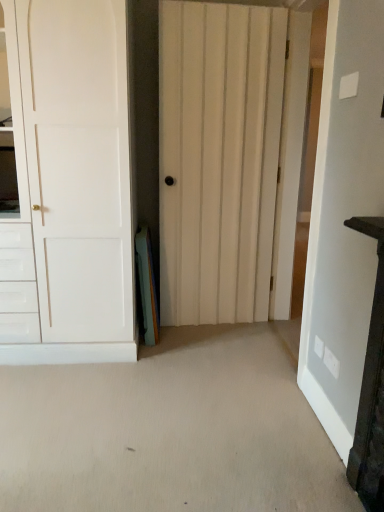
Question: Is white wooden door at center, the first door in the right-to-left sequence, at the left side of dark wood vanity at right?

Choices:
 (A) no
 (B) yes

Answer: (B)

Question: From the image's perspective, is white wooden door at center, marked as the third door in a left-to-right arrangement, under dark wood vanity at right?

Choices:
 (A) yes
 (B) no

Answer: (B)

Question: Does white wooden door at center, marked as the third door in a left-to-right arrangement, contain dark wood vanity at right?

Choices:
 (A) yes
 (B) no

Answer: (B)

Question: From a real-world perspective, is white wooden door at center, the first door in the right-to-left sequence, physically below dark wood vanity at right?

Choices:
 (A) no
 (B) yes

Answer: (A)

Question: Considering the relative sizes of white wooden door at center, the first door in the right-to-left sequence, and dark wood vanity at right in the image provided, is white wooden door at center, the first door in the right-to-left sequence, smaller than dark wood vanity at right?

Choices:
 (A) yes
 (B) no

Answer: (B)

Question: Would you say white wooden door at center, marked as the third door in a left-to-right arrangement, is to the left or to the right of white wood door at center, positioned as the second door in left-to-right order, in the picture?

Choices:
 (A) left
 (B) right

Answer: (B)

Question: In terms of height, does white wooden door at center, marked as the third door in a left-to-right arrangement, look taller or shorter compared to white wood door at center, positioned as the second door in left-to-right order?

Choices:
 (A) tall
 (B) short

Answer: (A)

Question: Is point (359, 113) closer or farther from the camera than point (187, 139)?

Choices:
 (A) closer
 (B) farther

Answer: (A)

Question: Relative to white wood door at center, positioned as the second door in left-to-right order, is white wooden door at center, the first door in the right-to-left sequence, in front or behind?

Choices:
 (A) front
 (B) behind

Answer: (A)

Question: Is white matte door at left, the 1th door in the left-to-right sequence, wider or thinner than dark wood vanity at right?

Choices:
 (A) thin
 (B) wide

Answer: (B)

Question: From the image's perspective, is white matte door at left, the 3th door viewed from the right, above or below dark wood vanity at right?

Choices:
 (A) below
 (B) above

Answer: (B)

Question: Based on their sizes in the image, would you say white matte door at left, the 3th door viewed from the right, is bigger or smaller than dark wood vanity at right?

Choices:
 (A) big
 (B) small

Answer: (A)

Question: Is white matte door at left, the 1th door in the left-to-right sequence, inside the boundaries of dark wood vanity at right, or outside?

Choices:
 (A) outside
 (B) inside

Answer: (A)

Question: In terms of height, does dark wood vanity at right look taller or shorter compared to white wooden door at center, the first door in the right-to-left sequence?

Choices:
 (A) short
 (B) tall

Answer: (A)

Question: Is dark wood vanity at right inside the boundaries of white wooden door at center, marked as the third door in a left-to-right arrangement, or outside?

Choices:
 (A) outside
 (B) inside

Answer: (A)